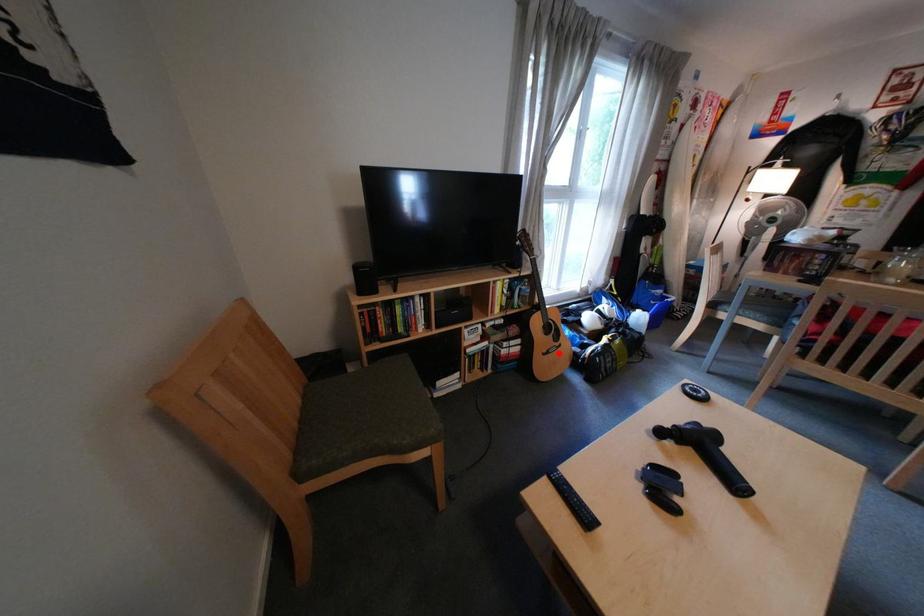
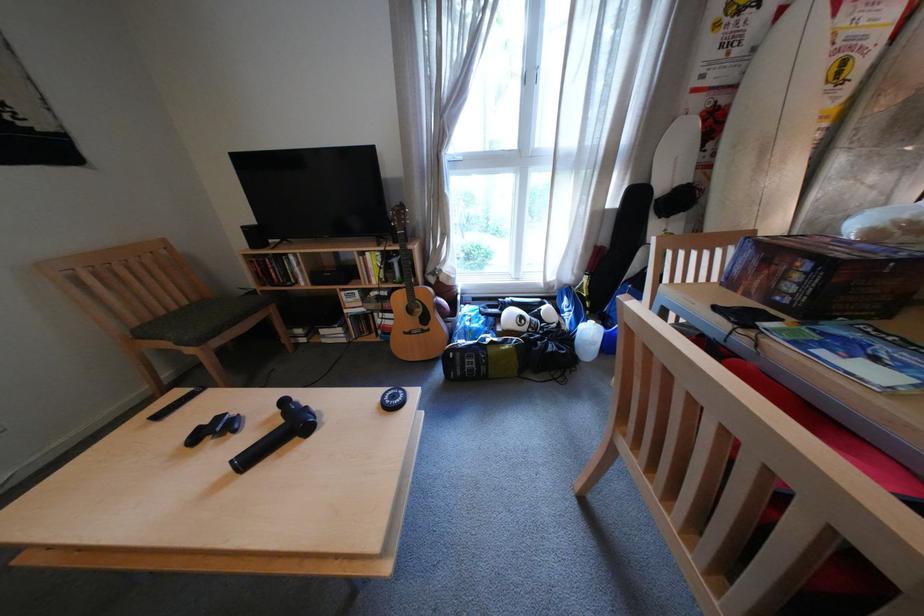
Where in the second image is the point corresponding to the highlighted location from the first image?

(420, 331)